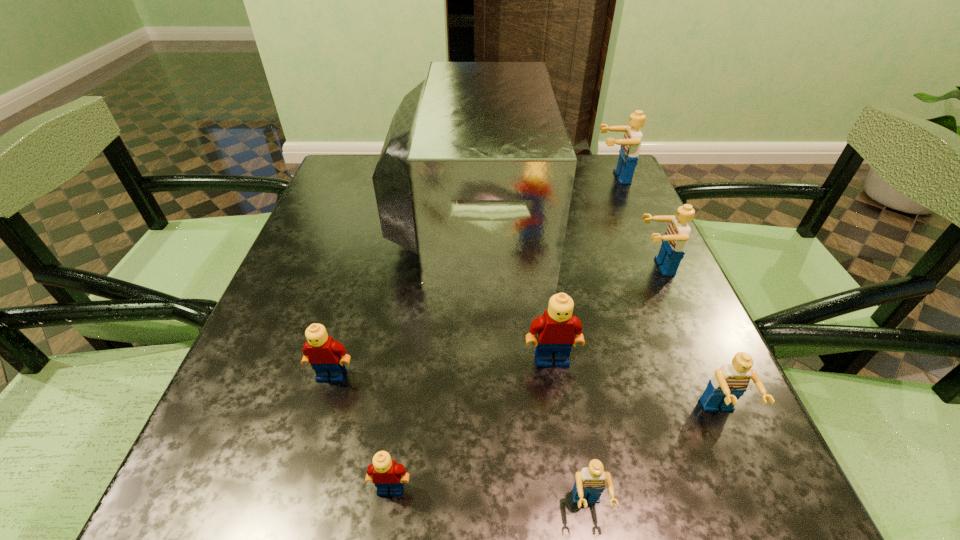
Locate an element on the screen. microwave oven is located at coordinates (476, 173).

Identify the location of the tallest object. (476, 173).

You are a GUI agent. You are given a task and a screenshot of the screen. Output one action in this format:
    pyautogui.click(x=<x>, y=<y>)
    Task: Click on the biggest blue Lego
    
    Given the screenshot: What is the action you would take?
    pyautogui.click(x=630, y=144)

This screenshot has width=960, height=540. Identify the location of the farthest blue Lego. (630, 144).

Image resolution: width=960 pixels, height=540 pixels. I want to click on the third nearest blue Lego, so click(674, 242).

Where is `the third smallest blue Lego`? the third smallest blue Lego is located at coordinates (674, 242).

Find the location of a particular element. the rightmost yellow Lego is located at coordinates (558, 330).

You are a GUI agent. You are given a task and a screenshot of the screen. Output one action in this format:
    pyautogui.click(x=<x>, y=<y>)
    Task: Click on the leftmost yellow Lego
    This screenshot has width=960, height=540.
    Given the screenshot: What is the action you would take?
    pyautogui.click(x=326, y=356)

I want to click on the leftmost object, so click(326, 356).

This screenshot has height=540, width=960. In order to click on the third nearest Lego in this screenshot , I will do `click(729, 383)`.